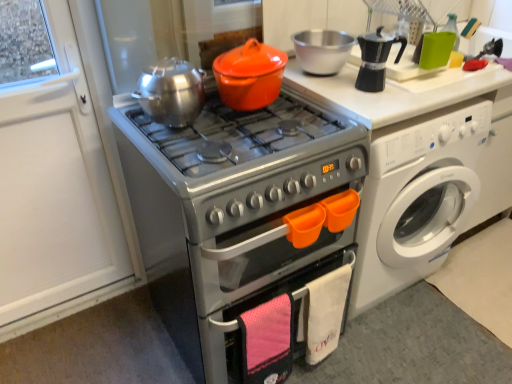
Question: From a real-world perspective, relative to white glossy washing machine at right, is silver metallic oven at center vertically above or below?

Choices:
 (A) below
 (B) above

Answer: (B)

Question: Which is correct: silver metallic oven at center is inside white glossy washing machine at right, or outside of it?

Choices:
 (A) outside
 (B) inside

Answer: (A)

Question: Estimate the real-world distances between objects in this image. Which object is farther from the white glossy washing machine at right?

Choices:
 (A) silver metallic oven at center
 (B) brushed metal tea pot at upper center
 (C) orange matte crock pot at center

Answer: (B)

Question: Which object is positioned farthest from the brushed metal tea pot at upper center?

Choices:
 (A) orange matte crock pot at center
 (B) silver metallic oven at center
 (C) white glossy washing machine at right

Answer: (C)